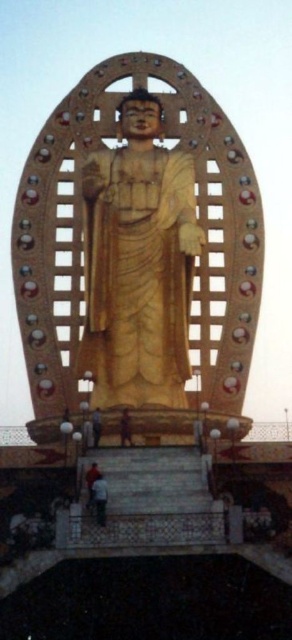
You are standing in front of the Buddha statue and notice two items in the scene. Which item is narrower between the dark brown leather shoes at lower center and the orange fabric person at lower left?

The dark brown leather shoes at lower center is thinner than the orange fabric person at lower left, so the dark brown leather shoes at lower center is narrower between the two.

You are standing in front of the Buddha statue and want to place a small offering at the exact location marked by the point with coordinates (126, 428). Based on the scene description, where should you place the offering?

You should place the offering on the dark brown leather shoes at lower center, as the point (126, 428) is located there.